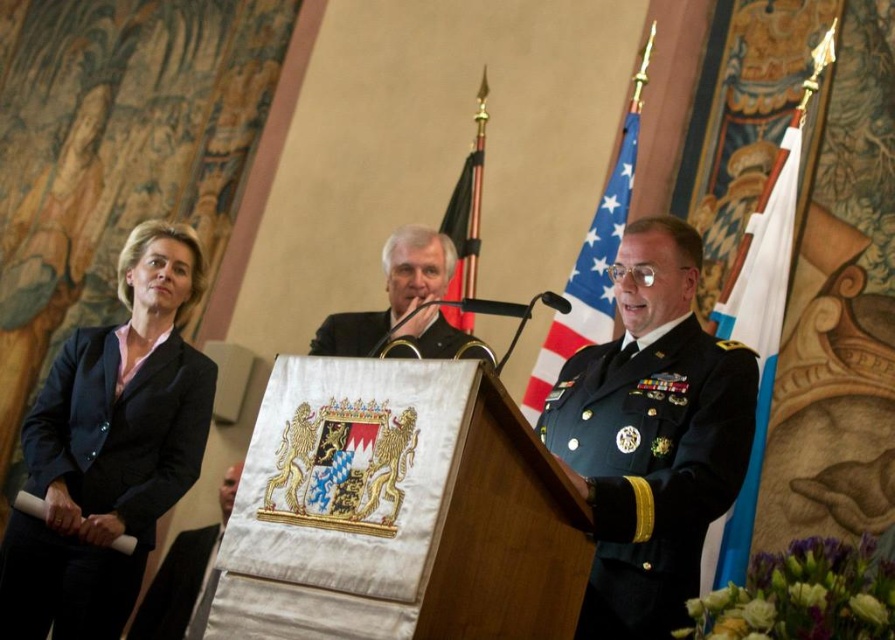
Question: Is green military uniform at center behind white fabric flag at right?

Choices:
 (A) no
 (B) yes

Answer: (A)

Question: Which of the following is the closest to the observer?

Choices:
 (A) white fabric flag at right
 (B) american flag at center
 (C) dark suit at center
 (D) silk flag at center

Answer: (C)

Question: Observing the image, what is the correct spatial positioning of black fabric uniform at left in reference to black fabric uniform at center?

Choices:
 (A) above
 (B) below

Answer: (B)

Question: Which is farther from the american flag at center?

Choices:
 (A) black fabric uniform at center
 (B) black fabric uniform at left
 (C) navy blue fabric suit at left
 (D) green military uniform at center

Answer: (B)

Question: Which of the following is the closest to the observer?

Choices:
 (A) american flag at center
 (B) white fabric flag at right
 (C) black fabric uniform at center

Answer: (C)

Question: Is green military uniform at center closer to the viewer compared to black fabric uniform at center?

Choices:
 (A) no
 (B) yes

Answer: (A)